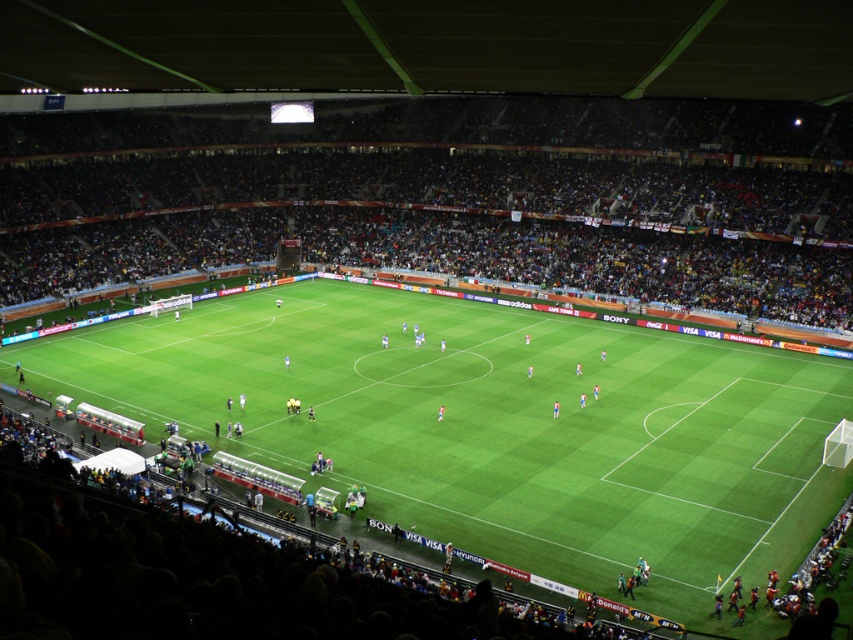
Can you confirm if green grass football field at center is positioned to the right of dark brown stadium seats at center?

Indeed, green grass football field at center is positioned on the right side of dark brown stadium seats at center.

Can you confirm if green grass football field at center is positioned below dark brown stadium seats at center?

Correct, green grass football field at center is located below dark brown stadium seats at center.

Where is `green grass football field at center`? green grass football field at center is located at coordinates (497, 426).